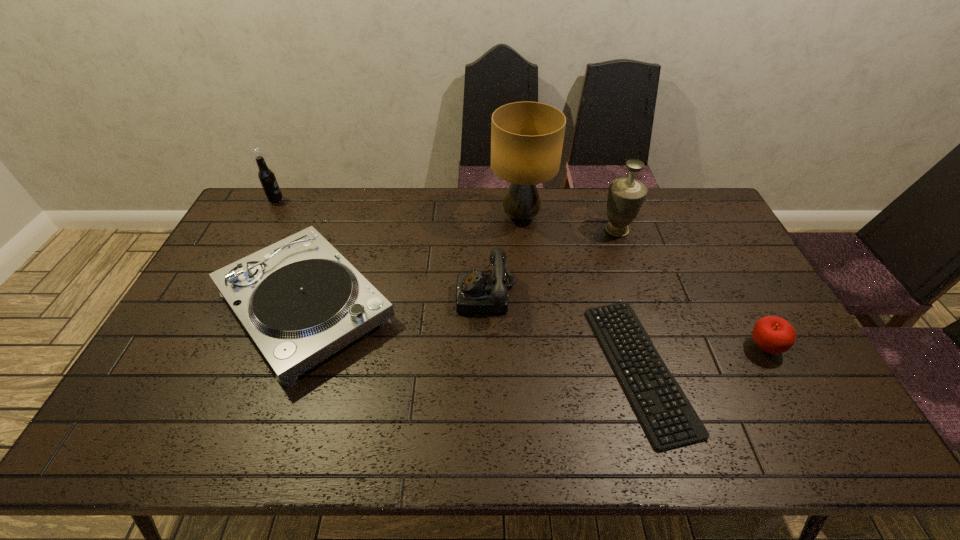
Find the location of `root beer located at the left edge`. root beer located at the left edge is located at coordinates (266, 176).

Identify the location of record player located at the left edge. The image size is (960, 540). (300, 301).

Locate an element on the screen. This screenshot has width=960, height=540. object that is positioned at the right edge is located at coordinates (772, 334).

I want to click on object that is positioned at the far left corner, so click(266, 176).

The height and width of the screenshot is (540, 960). I want to click on free space at the far edge, so click(x=462, y=195).

You are a GUI agent. You are given a task and a screenshot of the screen. Output one action in this format:
    pyautogui.click(x=<x>, y=<y>)
    Task: Click on the free space at the near edge
    
    Given the screenshot: What is the action you would take?
    pyautogui.click(x=606, y=452)

In the image, there is a desktop. Where is `vacant space at the left edge`? The height and width of the screenshot is (540, 960). vacant space at the left edge is located at coordinates (216, 332).

The height and width of the screenshot is (540, 960). Identify the location of vacant space at the right edge of the desktop. (794, 372).

The image size is (960, 540). I want to click on free region at the far right corner of the desktop, so point(688,214).

Identify the location of vacant region between the fourth shortest object and the urn. (551, 262).